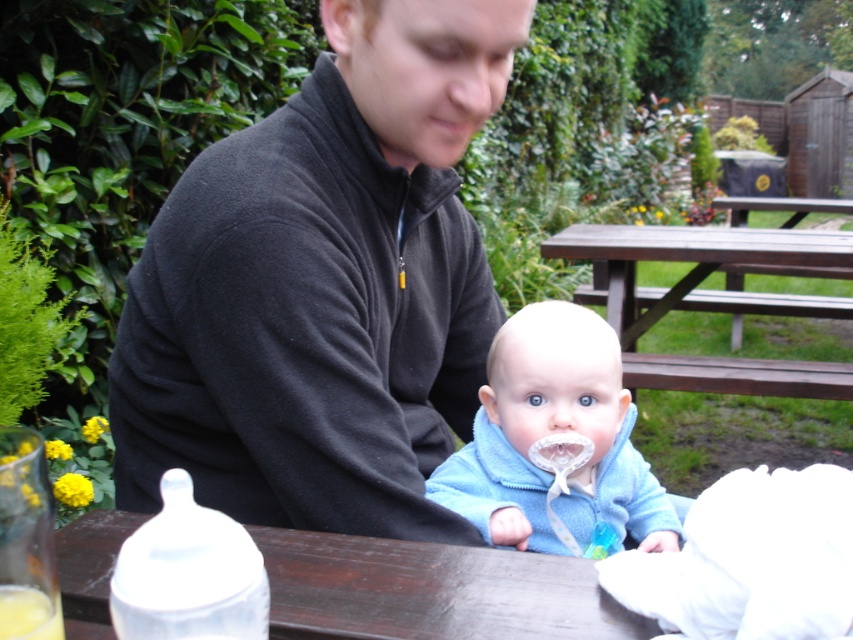
Does transparent plastic bottle at lower center have a lesser height compared to blue fleece jacket at center?

Indeed, transparent plastic bottle at lower center has a lesser height compared to blue fleece jacket at center.

In order to click on transparent plastic bottle at lower center in this screenshot , I will do click(x=431, y=589).

Is point (386, 579) in front of point (531, 480)?

Yes, point (386, 579) is in front of point (531, 480).

Locate an element on the screen. This screenshot has width=853, height=640. transparent plastic bottle at lower center is located at coordinates (431, 589).

Can you confirm if blue fleece jacket at center is positioned above brown wooden picnic table at center?

Incorrect, blue fleece jacket at center is not positioned above brown wooden picnic table at center.

Is blue fleece jacket at center smaller than brown wooden picnic table at center?

Yes.

This screenshot has height=640, width=853. Identify the location of blue fleece jacket at center. (555, 440).

Describe the element at coordinates (555, 440) in the screenshot. This screenshot has height=640, width=853. I see `blue fleece jacket at center` at that location.

Does blue fleece jacket at center appear on the left side of transparent plastic bottle at lower left?

Incorrect, blue fleece jacket at center is not on the left side of transparent plastic bottle at lower left.

The image size is (853, 640). I want to click on blue fleece jacket at center, so click(x=555, y=440).